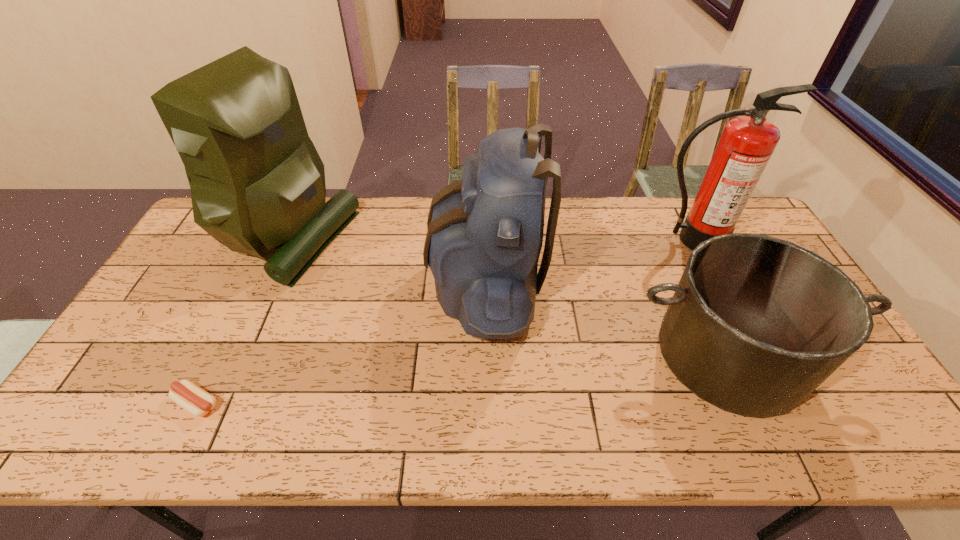
Find the location of a particular element. This screenshot has height=540, width=960. free spot that satisfies the following two spatial constraints: 1. at the front pocket of the pan; 2. on the left side of the right backpack is located at coordinates (486, 355).

Image resolution: width=960 pixels, height=540 pixels. I want to click on free space that satisfies the following two spatial constraints: 1. on the front-facing side of the fire extinguisher; 2. at the front pocket of the right backpack, so click(x=713, y=284).

You are a GUI agent. You are given a task and a screenshot of the screen. Output one action in this format:
    pyautogui.click(x=<x>, y=<y>)
    Task: Click on the vacant point that satisfies the following two spatial constraints: 1. on the front-facing side of the fire extinguisher; 2. at the front pocket of the right backpack
    The width and height of the screenshot is (960, 540).
    Given the screenshot: What is the action you would take?
    pyautogui.click(x=713, y=284)

Locate an element on the screen. The height and width of the screenshot is (540, 960). free space that satisfies the following two spatial constraints: 1. on the front of the left backpack with visible pockets; 2. on the right side of the fourth tallest object is located at coordinates (230, 355).